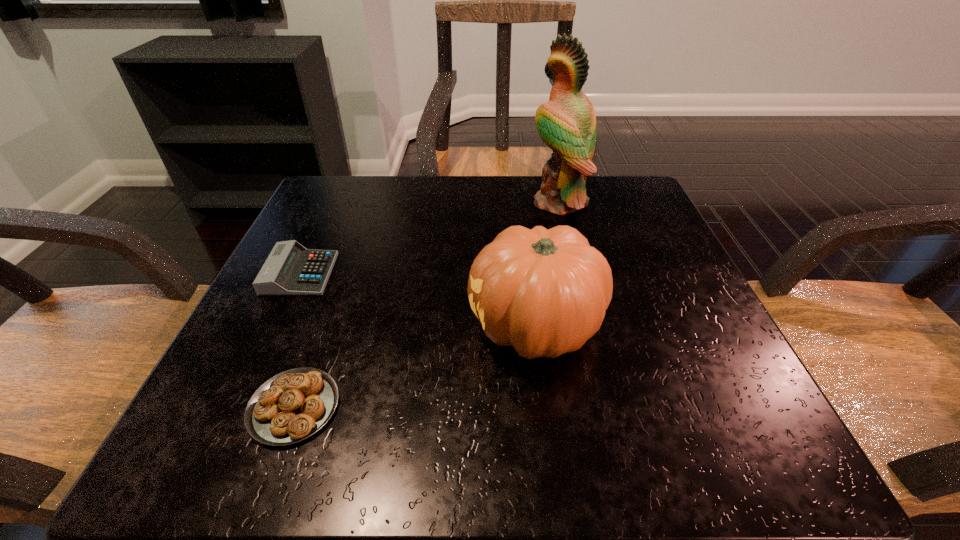
At what (x,y) coordinates should I click in order to perform the action: click on free spot at the far edge of the desktop. Please return your answer as a coordinate pair (x, y). The height and width of the screenshot is (540, 960). Looking at the image, I should click on (411, 225).

Where is `free space at the near edge of the desktop`? This screenshot has height=540, width=960. free space at the near edge of the desktop is located at coordinates (526, 430).

What are the coordinates of `free space at the left edge` in the screenshot? It's located at (266, 300).

Identify the location of blank space at the right edge of the desktop. (668, 353).

In the image, there is a desktop. Identify the location of vacant space at the far left corner. This screenshot has height=540, width=960. (383, 179).

I want to click on free region at the far right corner of the desktop, so click(x=624, y=208).

At what (x,y) coordinates should I click in order to perform the action: click on empty space between the third shortest object and the pastry. Please return your answer as a coordinate pair (x, y). The width and height of the screenshot is (960, 540). Looking at the image, I should click on (415, 367).

Locate an element on the screen. The image size is (960, 540). free space between the pastry and the third shortest object is located at coordinates (415, 367).

Locate an element on the screen. vacant area that lies between the calculator and the farthest object is located at coordinates (429, 238).

Image resolution: width=960 pixels, height=540 pixels. What are the coordinates of `free spot between the second tallest object and the pastry` in the screenshot? It's located at (415, 367).